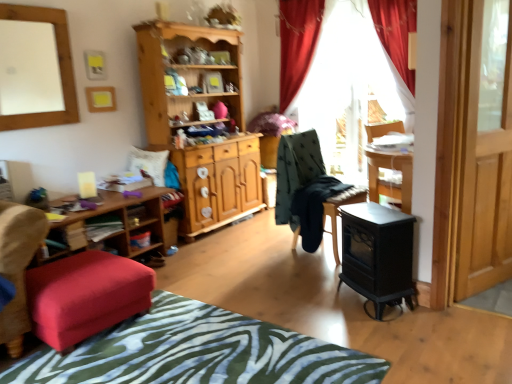
The width and height of the screenshot is (512, 384). What are the coordinates of `vacant space to the left of black matte wood stove at lower right` in the screenshot? It's located at (322, 301).